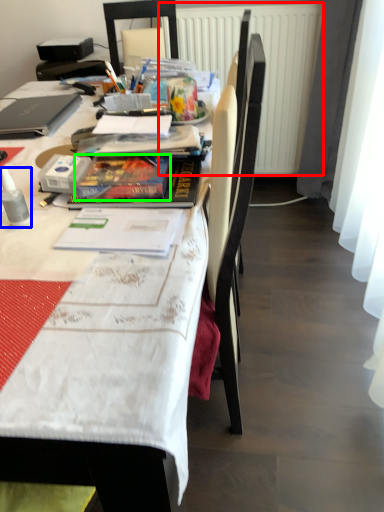
Question: Which is nearer to the radiator (highlighted by a red box)? bottle (highlighted by a blue box) or paperback book (highlighted by a green box).

Choices:
 (A) bottle
 (B) paperback book

Answer: (B)